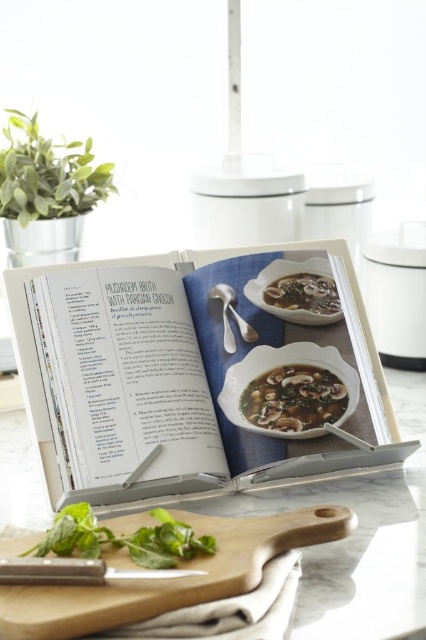
Is the position of white glossy cookbook at center more distant than that of wooden cutting board at lower center?

Yes, white glossy cookbook at center is behind wooden cutting board at lower center.

Between white glossy cookbook at center and wooden cutting board at lower center, which one has more height?

white glossy cookbook at center is taller.

The image size is (426, 640). In order to click on white glossy cookbook at center in this screenshot , I will do `click(187, 374)`.

Where is `white glossy cookbook at center`? This screenshot has width=426, height=640. white glossy cookbook at center is located at coordinates (187, 374).

Is point (62, 532) farther from viewer compared to point (328, 308)?

No, (62, 532) is closer to viewer.

Is point (183, 552) farther from viewer compared to point (299, 305)?

That is False.

The width and height of the screenshot is (426, 640). I want to click on green leafy herb at lower left, so click(x=123, y=538).

Is white glossy cookbook at center taller than satin silver spoon at upper center?

Yes, white glossy cookbook at center is taller than satin silver spoon at upper center.

This screenshot has height=640, width=426. Find the location of `white glossy cookbook at center`. white glossy cookbook at center is located at coordinates (187, 374).